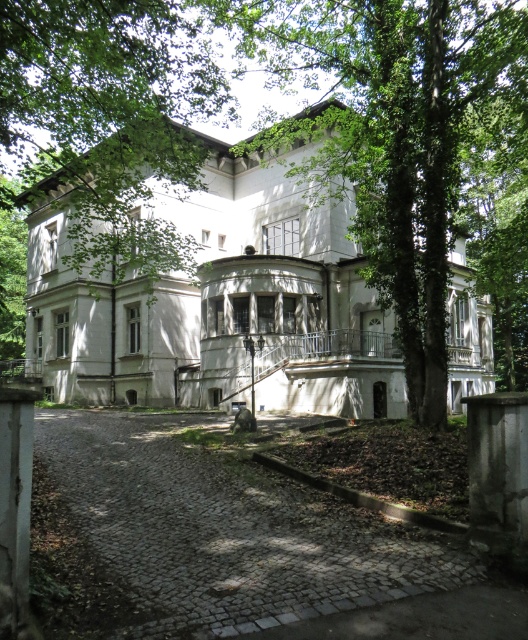
Question: Is gray stone column at center smaller than white stone pillar at left?

Choices:
 (A) yes
 (B) no

Answer: (B)

Question: Which point appears closest to the camera in this image?

Choices:
 (A) (14, 589)
 (B) (501, 417)
 (C) (301, 540)

Answer: (A)

Question: Which point appears closest to the camera in this image?

Choices:
 (A) (16, 554)
 (B) (223, 572)
 (C) (323, 243)
 (D) (513, 344)

Answer: (A)

Question: Which point appears farthest from the camera in this image?

Choices:
 (A) (118, 429)
 (B) (476, 502)
 (C) (260, 186)
 (D) (3, 618)

Answer: (C)

Question: Does green leafy tree at center come behind cobblestone driveway at lower center?

Choices:
 (A) no
 (B) yes

Answer: (B)

Question: Is green leafy tree at center above gray stone column at center?

Choices:
 (A) yes
 (B) no

Answer: (A)